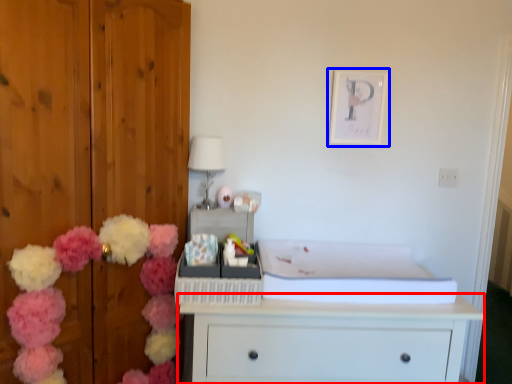
Question: Among these objects, which one is nearest to the camera, chest of drawers (highlighted by a red box) or picture frame (highlighted by a blue box)?

Choices:
 (A) chest of drawers
 (B) picture frame

Answer: (A)